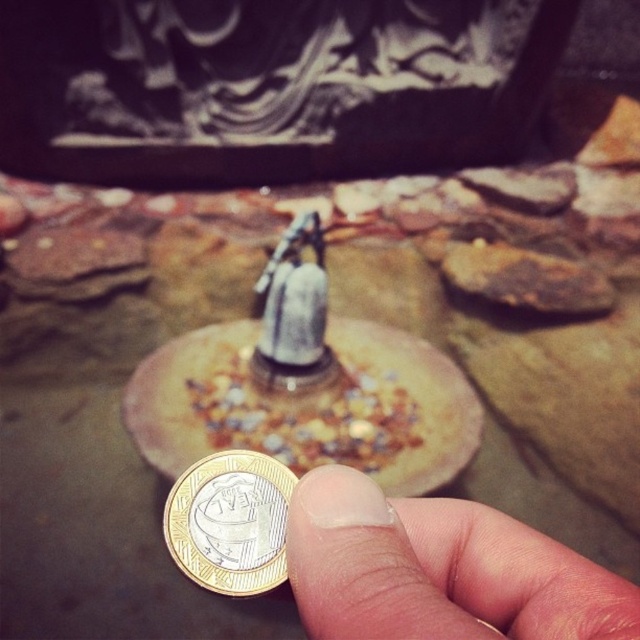
Is smooth skin at center further to the viewer compared to silver metallic bell at center?

No, smooth skin at center is closer to the viewer.

You are a GUI agent. You are given a task and a screenshot of the screen. Output one action in this format:
    pyautogui.click(x=<x>, y=<y>)
    Task: Click on the smooth skin at center
    This screenshot has height=640, width=640.
    Given the screenshot: What is the action you would take?
    pyautogui.click(x=438, y=570)

Does gold metallic coin at center have a greater height compared to silver metallic bell at center?

Incorrect, gold metallic coin at center's height is not larger of silver metallic bell at center's.

Is point (262, 573) in front of point (308, 269)?

Yes, point (262, 573) is in front of point (308, 269).

Is point (186, 547) closer to viewer compared to point (308, 307)?

Yes, it is.

Where is `gold metallic coin at center`? This screenshot has width=640, height=640. gold metallic coin at center is located at coordinates (230, 522).

Can you confirm if smooth skin at center is positioned to the left of gold metallic coin at center?

No, smooth skin at center is not to the left of gold metallic coin at center.

Is point (451, 595) positioned behind point (196, 472)?

Yes, point (451, 595) is behind point (196, 472).

Locate an element on the screen. This screenshot has height=640, width=640. smooth skin at center is located at coordinates click(438, 570).